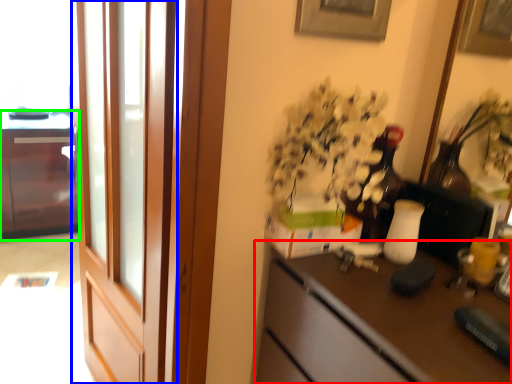
Question: Which object is positioned closest to desk (highlighted by a red box)? Select from screen door (highlighted by a blue box) and cabinetry (highlighted by a green box).

Choices:
 (A) screen door
 (B) cabinetry

Answer: (A)